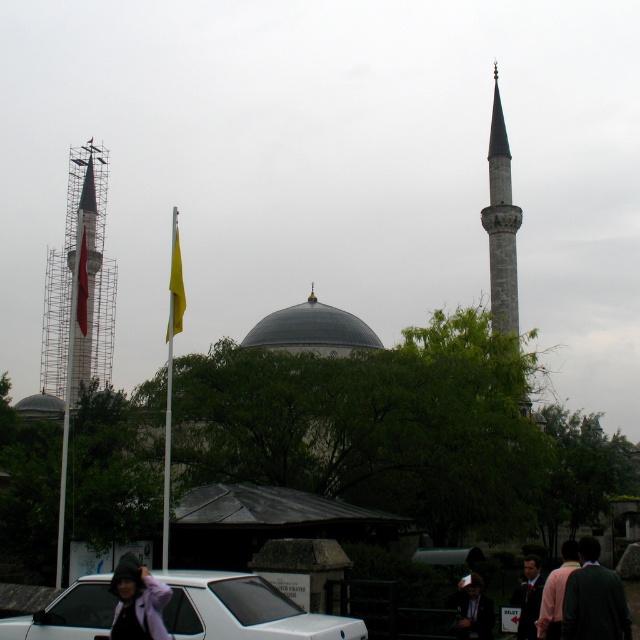
Question: Which point is closer to the camera?

Choices:
 (A) metallic scaffolding tower at left
 (B) pink fabric at lower right
 (C) yellow fabric flag at upper center

Answer: (B)

Question: Does metallic scaffolding tower at left have a greater width compared to dark green jacket at lower right?

Choices:
 (A) yes
 (B) no

Answer: (A)

Question: Estimate the real-world distances between objects in this image. Which object is closer to the yellow fabric flag at upper center?

Choices:
 (A) gray stone minaret at right
 (B) dark blue suit at lower right
 (C) pink fabric at lower right
 (D) white matte car at lower center

Answer: (D)

Question: Is metallic scaffolding tower at left thinner than pink fabric at lower right?

Choices:
 (A) yes
 (B) no

Answer: (A)

Question: Which point is closer to the camera?

Choices:
 (A) dark gray suit at lower right
 (B) light purple fabric at lower left

Answer: (B)

Question: Is light purple fabric at lower left to the left of pink fabric at lower right from the viewer's perspective?

Choices:
 (A) no
 (B) yes

Answer: (B)